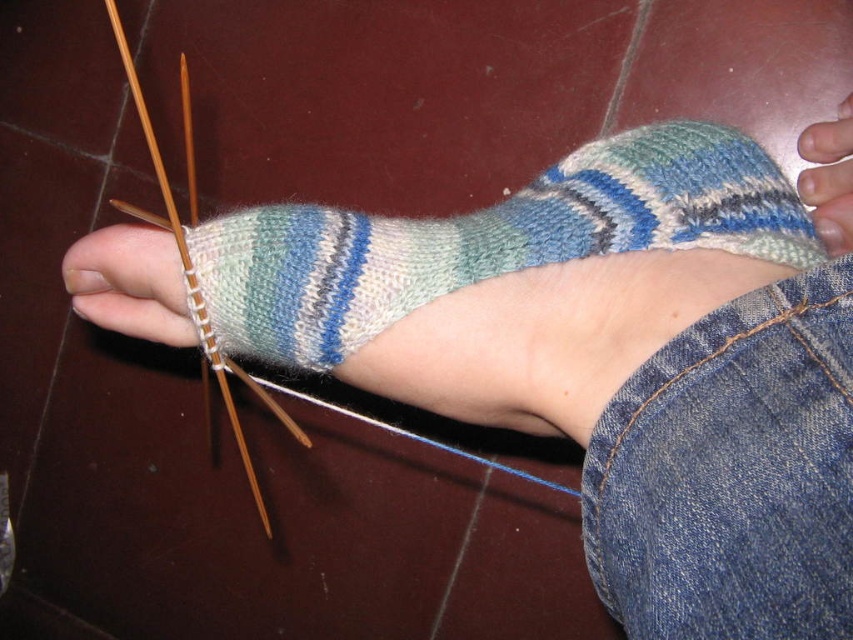
This screenshot has width=853, height=640. What do you see at coordinates (196, 288) in the screenshot? I see `wooden knitting needle at lower left` at bounding box center [196, 288].

Which of these two, wooden knitting needle at lower left or smooth skin at center, stands taller?

wooden knitting needle at lower left

Is point (155, 161) positioned behind point (833, 124)?

No.

In order to click on wooden knitting needle at lower left in this screenshot , I will do `click(196, 288)`.

Who is lower down, knitted woolen sock at center or wooden knitting needle at lower left?

Positioned lower is knitted woolen sock at center.

Is knitted woolen sock at center closer to the viewer compared to wooden knitting needle at lower left?

Yes, it is.

I want to click on knitted woolen sock at center, so click(x=488, y=240).

Does knitted woolen sock at center have a lesser height compared to smooth skin at center?

Incorrect, knitted woolen sock at center's height does not fall short of smooth skin at center's.

Measure the distance between point (339, 236) and camera.

52.78 centimeters

The height and width of the screenshot is (640, 853). I want to click on knitted woolen sock at center, so click(x=488, y=240).